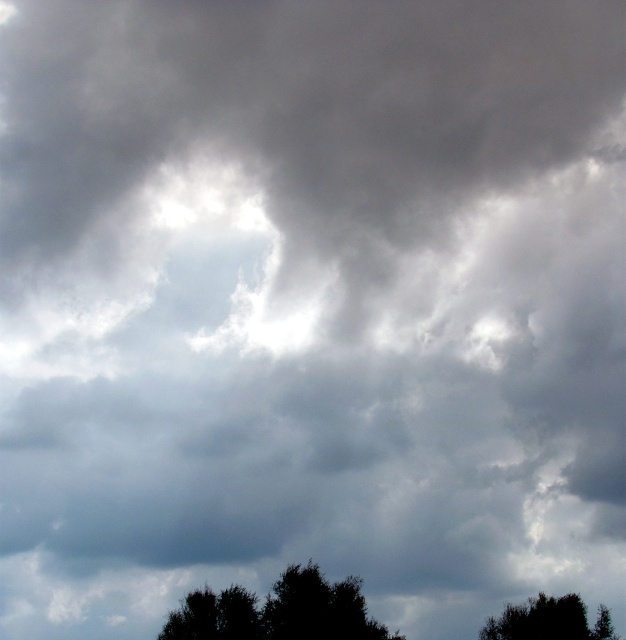
Is point (565, 595) positioned behind point (167, 621)?

Yes, point (565, 595) is behind point (167, 621).

The image size is (626, 640). In order to click on green leafy tree at lower right in this screenshot , I will do `click(548, 620)`.

Who is positioned more to the left, silhouette leafy tree at lower center or green leafy tree at lower center?

green leafy tree at lower center

Can you confirm if silhouette leafy tree at lower center is shorter than green leafy tree at lower center?

Incorrect, silhouette leafy tree at lower center's height does not fall short of green leafy tree at lower center's.

Between point (183, 634) and point (237, 589), which one is positioned in front?

Positioned in front is point (237, 589).

At what (x,y) coordinates should I click in order to perform the action: click on silhouette leafy tree at lower center. Please return your answer as a coordinate pair (x, y). This screenshot has height=640, width=626. Looking at the image, I should click on (279, 611).

Between silhouette leafy tree at lower center and green leafy tree at lower right, which one is positioned lower?

green leafy tree at lower right is below.

Which is behind, point (172, 620) or point (525, 620)?

The point (525, 620) is more distant.

Does point (245, 636) come behind point (553, 611)?

No, it is in front of (553, 611).

You are a GUI agent. You are given a task and a screenshot of the screen. Output one action in this format:
    pyautogui.click(x=<x>, y=<y>)
    Task: Click on the silhouette leafy tree at lower center
    Image resolution: width=626 pixels, height=640 pixels.
    Given the screenshot: What is the action you would take?
    pyautogui.click(x=279, y=611)